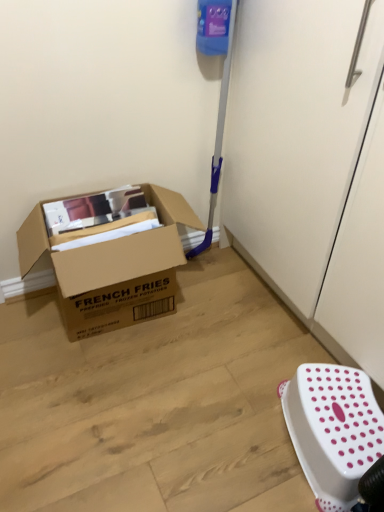
Question: Considering the positions of white plastic stool at lower right and brown cardboard box at left in the image, is white plastic stool at lower right taller or shorter than brown cardboard box at left?

Choices:
 (A) short
 (B) tall

Answer: (A)

Question: From a real-world perspective, relative to brown cardboard box at left, is white plastic stool at lower right vertically above or below?

Choices:
 (A) above
 (B) below

Answer: (B)

Question: Is white plastic stool at lower right situated inside brown cardboard box at left or outside?

Choices:
 (A) outside
 (B) inside

Answer: (A)

Question: From the image's perspective, is brown cardboard box at left located above or below white plastic stool at lower right?

Choices:
 (A) above
 (B) below

Answer: (A)

Question: Is point (84, 254) positioned closer to the camera than point (292, 407)?

Choices:
 (A) closer
 (B) farther

Answer: (B)

Question: Is brown cardboard box at left inside the boundaries of white plastic stool at lower right, or outside?

Choices:
 (A) inside
 (B) outside

Answer: (B)

Question: From their relative heights in the image, would you say brown cardboard box at left is taller or shorter than white plastic stool at lower right?

Choices:
 (A) short
 (B) tall

Answer: (B)